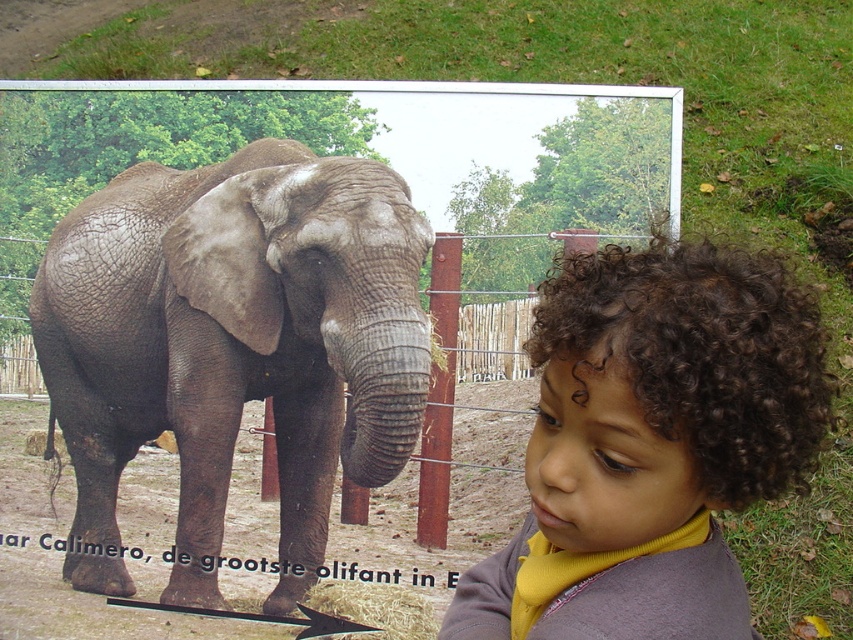
Question: Among these points, which one is nearest to the camera?

Choices:
 (A) (85, 566)
 (B) (762, 339)

Answer: (B)

Question: Is gray textured elephant at center to the right of curly brown hair at lower right from the viewer's perspective?

Choices:
 (A) no
 (B) yes

Answer: (A)

Question: Where is gray textured elephant at center located in relation to brown wooden fence at center in the image?

Choices:
 (A) right
 (B) left

Answer: (B)

Question: Which point appears closest to the camera in this image?

Choices:
 (A) (440, 337)
 (B) (554, 352)

Answer: (B)

Question: Which point appears farthest from the camera in this image?

Choices:
 (A) (563, 310)
 (B) (91, 554)

Answer: (B)

Question: Is curly brown hair at lower right smaller than brown wooden fence at center?

Choices:
 (A) yes
 (B) no

Answer: (B)